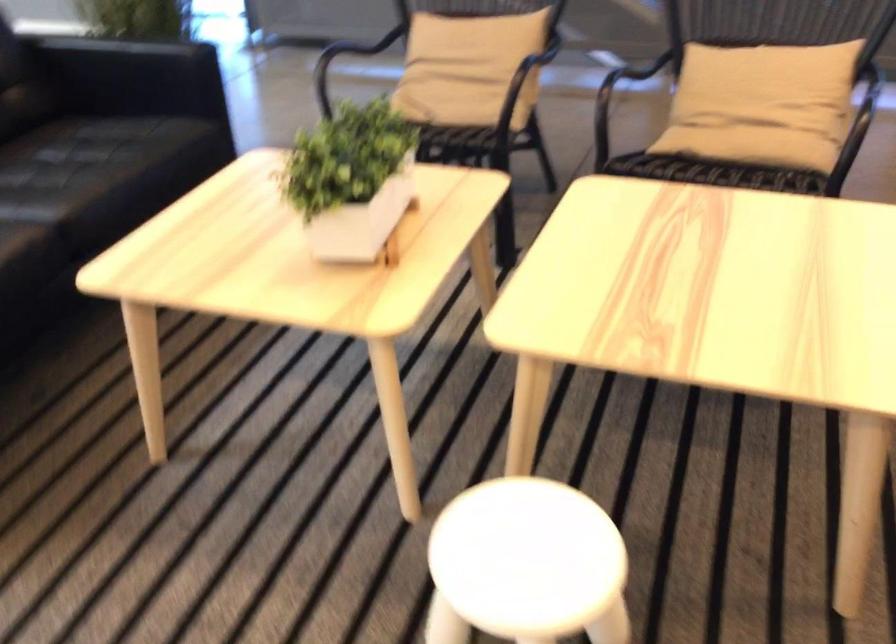
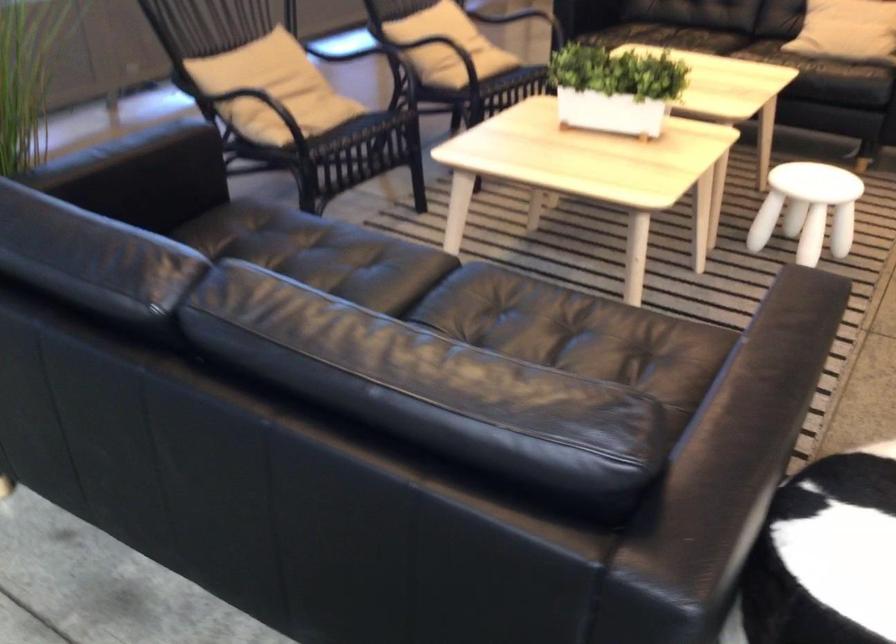
The point at (478, 563) is marked in the first image. Where is the corresponding point in the second image?

(807, 209)